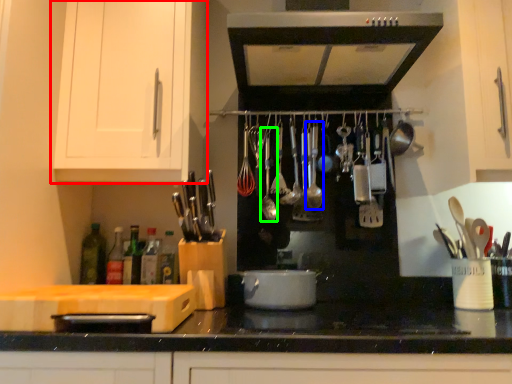
Question: Which object is the closest to the cabinetry (highlighted by a red box)? Choose among these: utensil (highlighted by a blue box) or utensil (highlighted by a green box).

Choices:
 (A) utensil
 (B) utensil

Answer: (B)